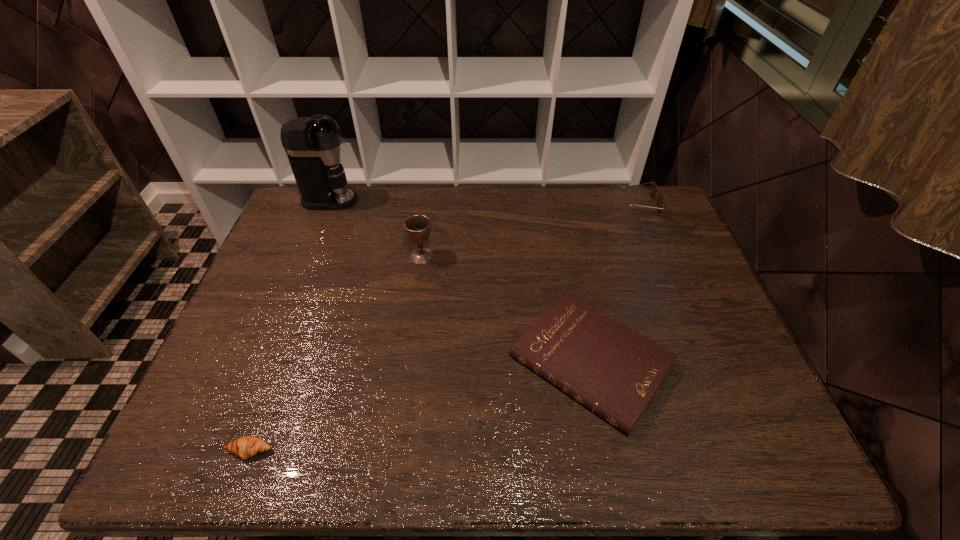
Locate an element on the screen. Image resolution: width=960 pixels, height=540 pixels. coffee maker is located at coordinates (313, 145).

In order to click on chalice in this screenshot , I will do `click(417, 227)`.

Find the location of a particular element. Image resolution: width=960 pixels, height=540 pixels. the fourth shortest object is located at coordinates (417, 227).

Locate an element on the screen. the rightmost object is located at coordinates (653, 189).

The height and width of the screenshot is (540, 960). What are the coordinates of `the third shortest object` in the screenshot? It's located at (653, 189).

Find the location of a particular element. The height and width of the screenshot is (540, 960). the second object from right to left is located at coordinates (613, 371).

Locate an element on the screen. The width and height of the screenshot is (960, 540). the fourth farthest object is located at coordinates (613, 371).

You are a GUI agent. You are given a task and a screenshot of the screen. Output one action in this format:
    pyautogui.click(x=<x>, y=<y>)
    Task: Click on the nearest object
    
    Given the screenshot: What is the action you would take?
    pyautogui.click(x=245, y=447)

Identify the location of vacant region located place cup under the spout of the coffee maker. (429, 200).

Where is `free space located on the left of the chalice`? The image size is (960, 540). free space located on the left of the chalice is located at coordinates (281, 256).